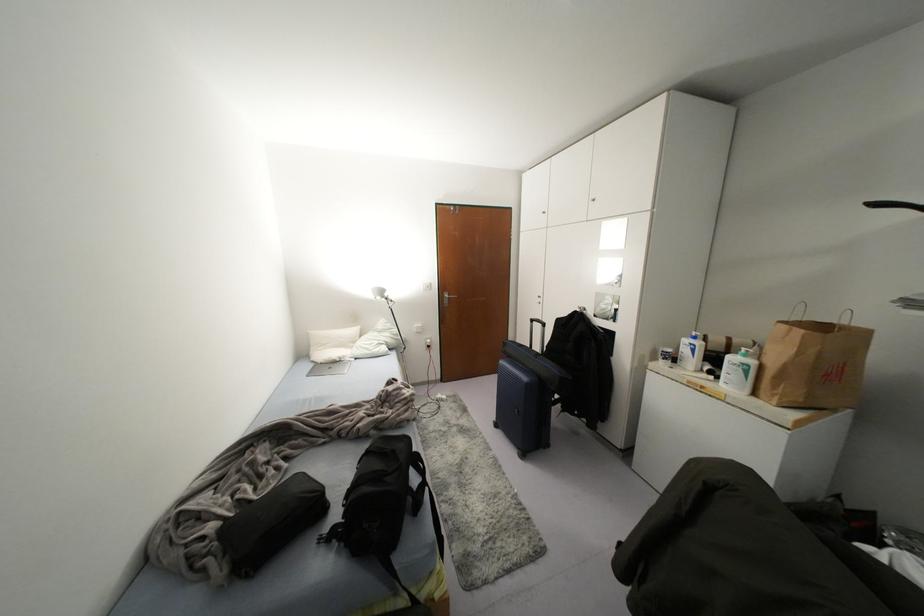
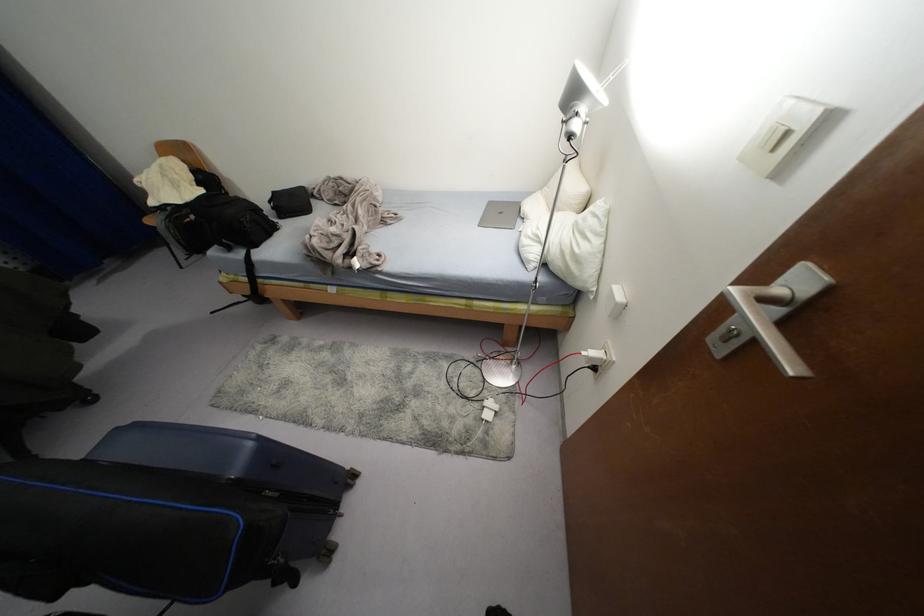
Find the pixel in the second image that matches [444,397] in the first image.

(487, 416)